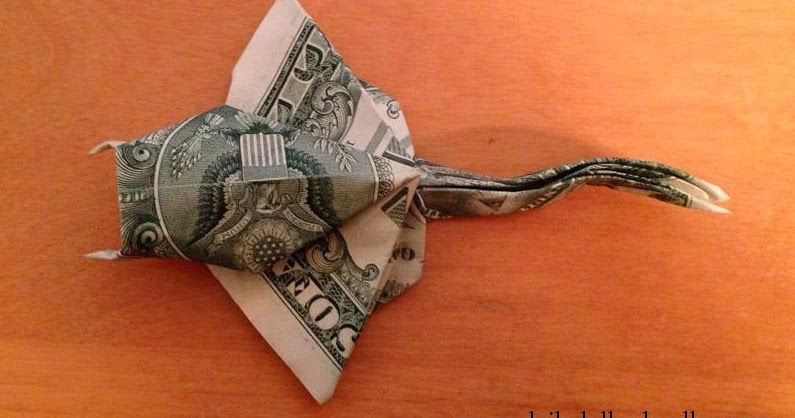
Locate an element on the screen. wood-like table top is located at coordinates (477, 327).